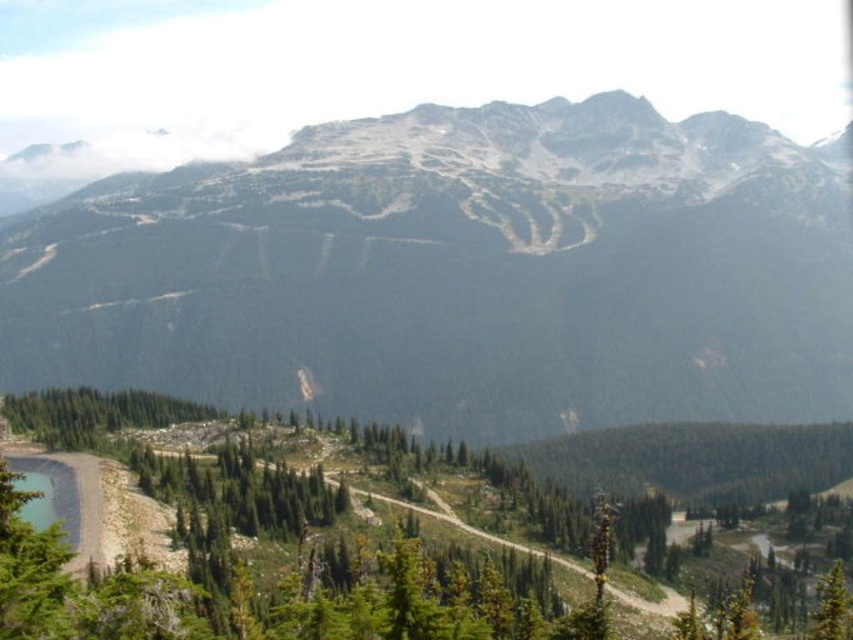
You are hiking along the winding dirt road in the mountain valley. You come across two points marked on your map. The first point is at coordinates point (x=415, y=573) and the second is at point (x=810, y=634). According to the map, which point is closer to you as you stand on the dirt road?

Point (x=415, y=573) is in front of point (x=810, y=634), so the first point is closer to you.

You are a hiker standing at the bottom of the rocky mountain at center. You want to reach the summit. If your average walking speed is 3 km per hour, how long would it take you to reach the summit?

The distance between the rocky mountain at center and the camera is 194.22 meters. To convert this distance to kilometers, divide by 1000, resulting in 0.19422 km. Dividing this by your walking speed of 3 km per hour gives approximately 0.0647 hours. Multiplying by 60 minutes per hour yields roughly 3.88 minutes. Therefore, it would take about 4 minutes to reach the summit.